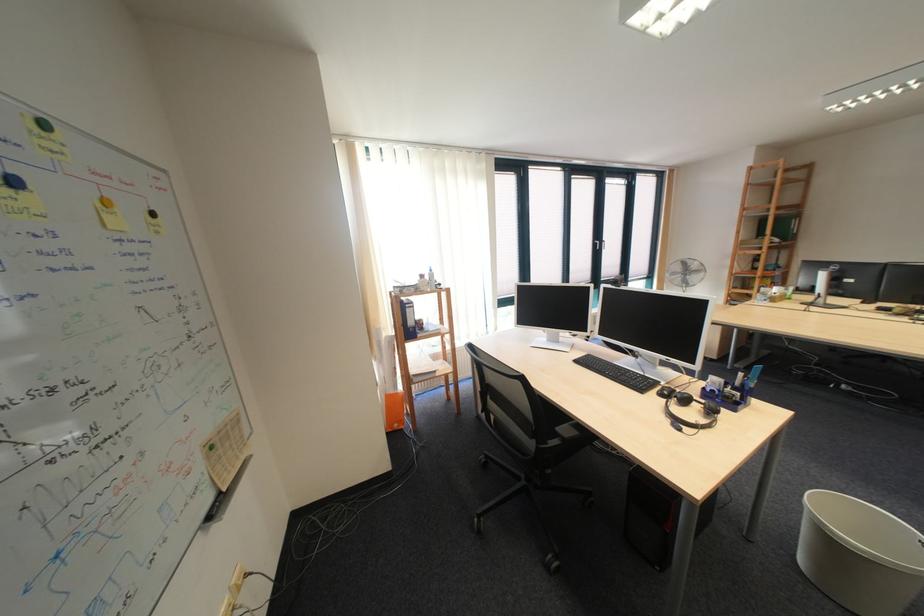
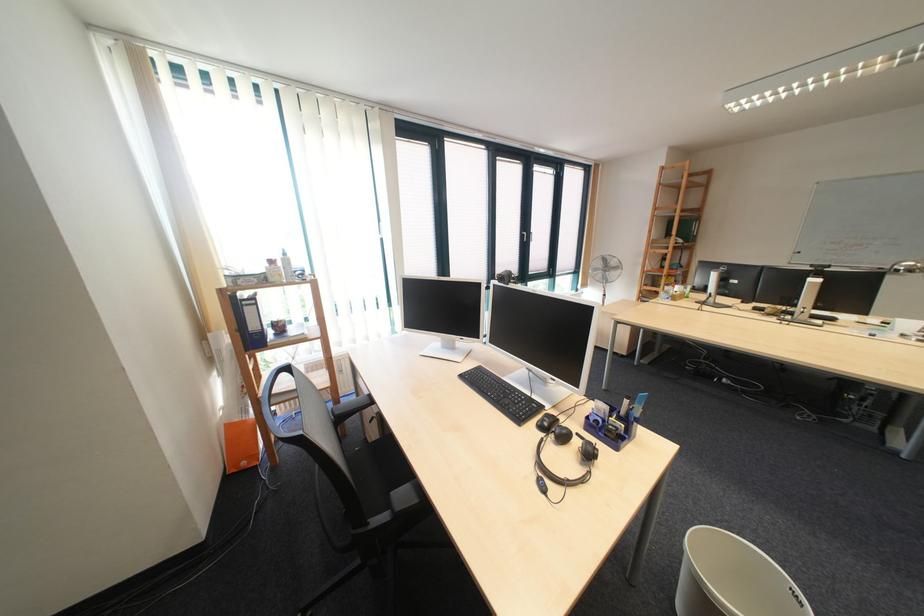
Where in the second image is the point corresponding to point (867, 541) from the first image?

(743, 605)